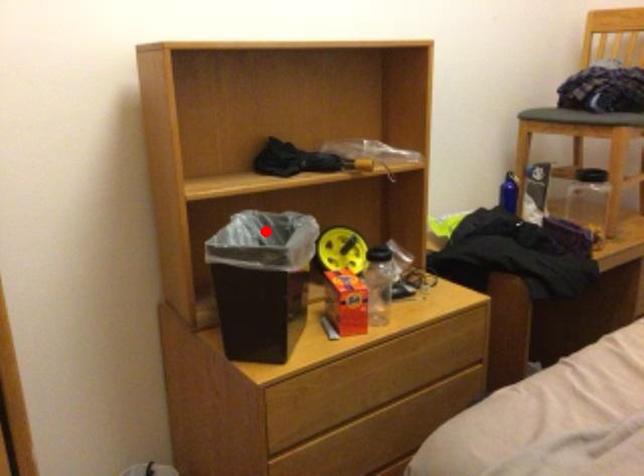
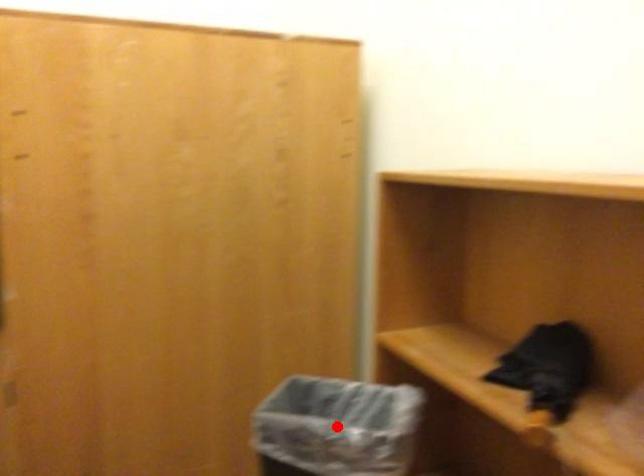
I am providing you with two images of the same scene from different viewpoints. A red point is marked on the first image and another point is marked on the second image. Does the point marked in image1 correspond to the same location as the one in image2?

Yes